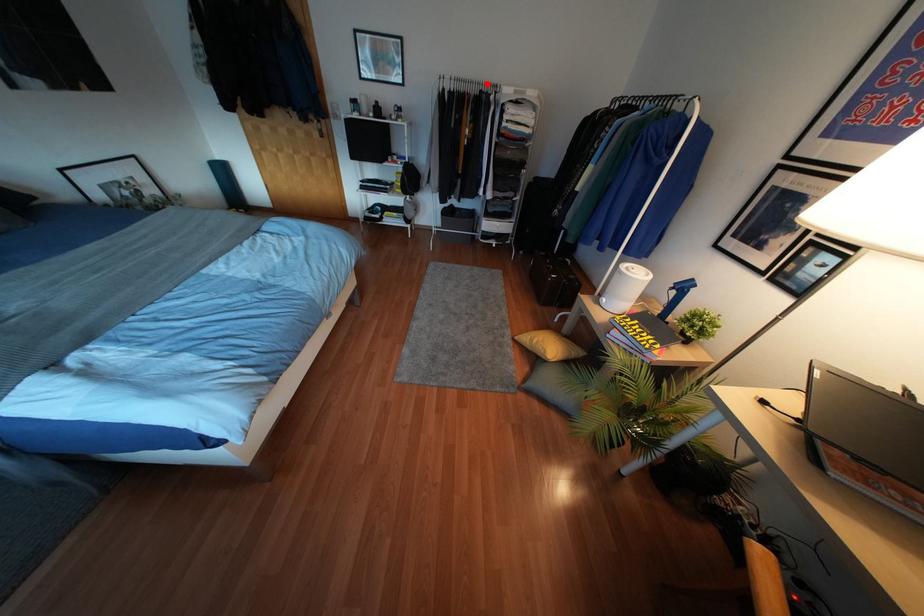
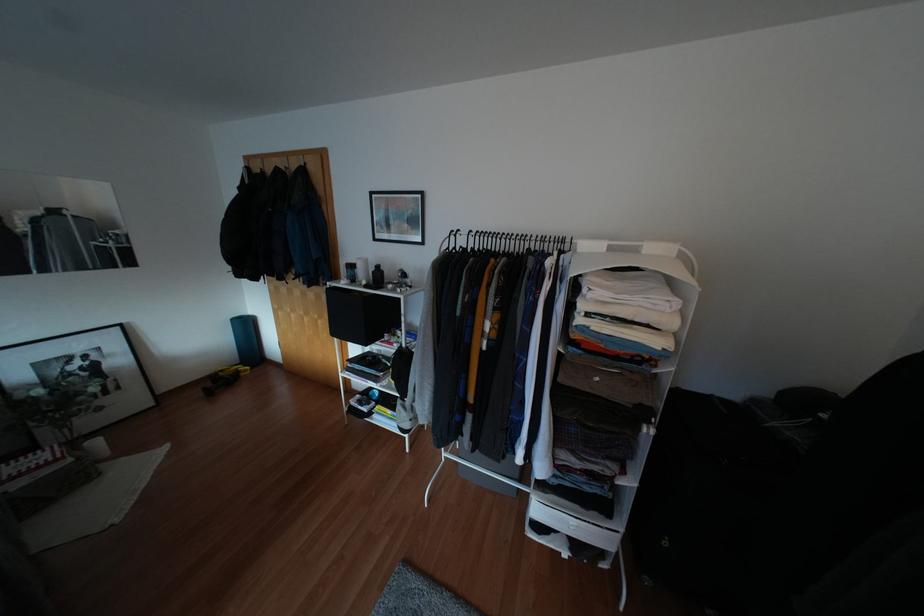
Question: I am providing you with two images of the same scene from different viewpoints. In image1, a red point is highlighted. Considering the same 3D point in image2, which of the following is correct?

Choices:
 (A) It is closer
 (B) It is farther

Answer: (B)